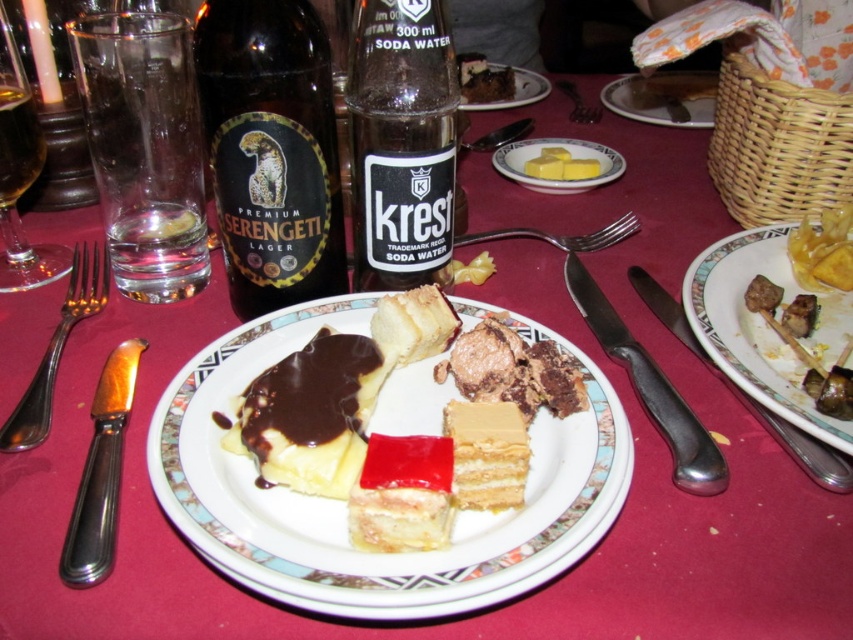
Which of these two, yellow sponge cake at center or yellow matte butter at upper right, stands taller?

yellow matte butter at upper right is taller.

Does yellow sponge cake at center have a smaller size compared to yellow matte butter at upper right?

Correct, yellow sponge cake at center occupies less space than yellow matte butter at upper right.

Which is behind, point (492, 422) or point (624, 164)?

The point (624, 164) is more distant.

Where is `yellow sponge cake at center`? Image resolution: width=853 pixels, height=640 pixels. yellow sponge cake at center is located at coordinates (486, 454).

Describe the element at coordinates (401, 144) in the screenshot. I see `black glass bottle at center` at that location.

Does point (398, 80) lie in front of point (199, 253)?

Yes, it is in front of point (199, 253).

Image resolution: width=853 pixels, height=640 pixels. What are the coordinates of `black glass bottle at center` in the screenshot? It's located at (401, 144).

Who is lower down, spongy white cake at center or yellow matte butter at upper right?

spongy white cake at center is lower down.

Is point (445, 346) less distant than point (556, 145)?

That is True.

Which is in front, point (445, 332) or point (531, 179)?

Point (445, 332)

You are a GUI agent. You are given a task and a screenshot of the screen. Output one action in this format:
    pyautogui.click(x=<x>, y=<y>)
    Task: Click on the spongy white cake at center
    Image resolution: width=853 pixels, height=640 pixels.
    Given the screenshot: What is the action you would take?
    (413, 324)